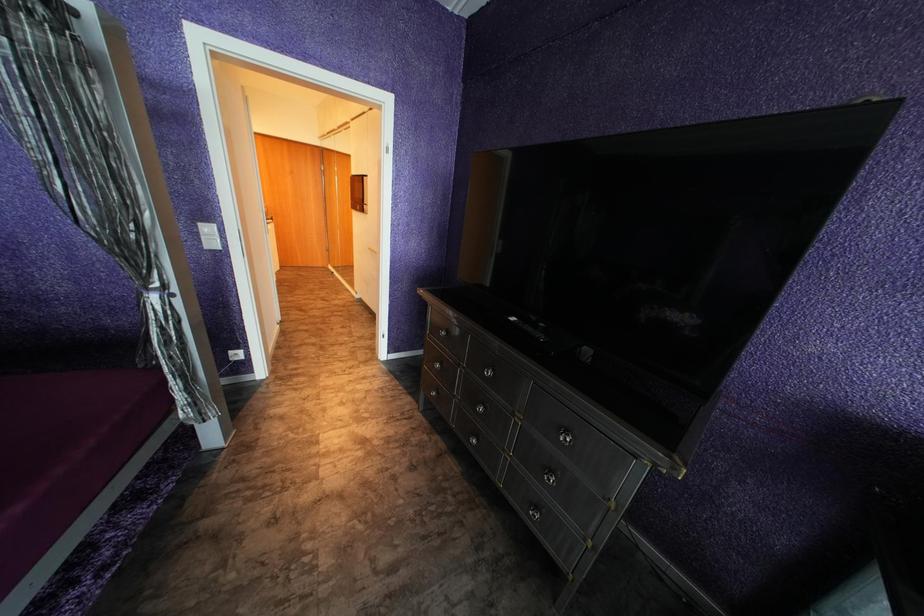
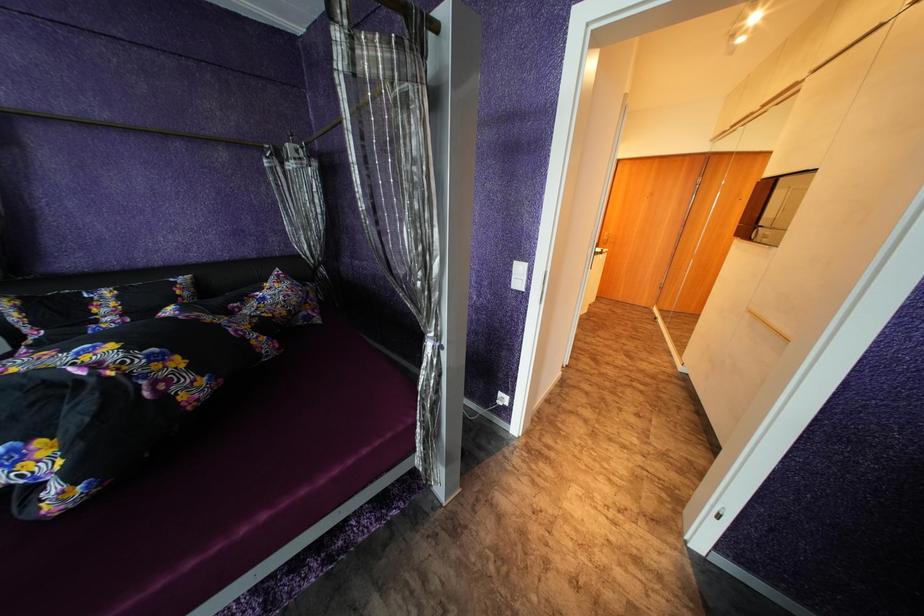
Question: How did the camera likely rotate?

Choices:
 (A) Left
 (B) Right
 (C) Up
 (D) Down

Answer: (A)